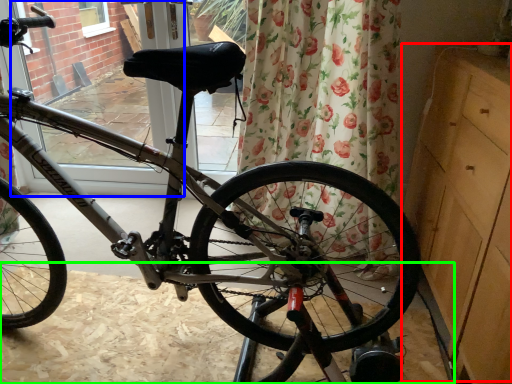
Question: Estimate the real-world distances between objects in this image. Which object is farther from dresser (highlighted by a red box), screen door (highlighted by a blue box) or dirt track (highlighted by a green box)?

Choices:
 (A) screen door
 (B) dirt track

Answer: (A)